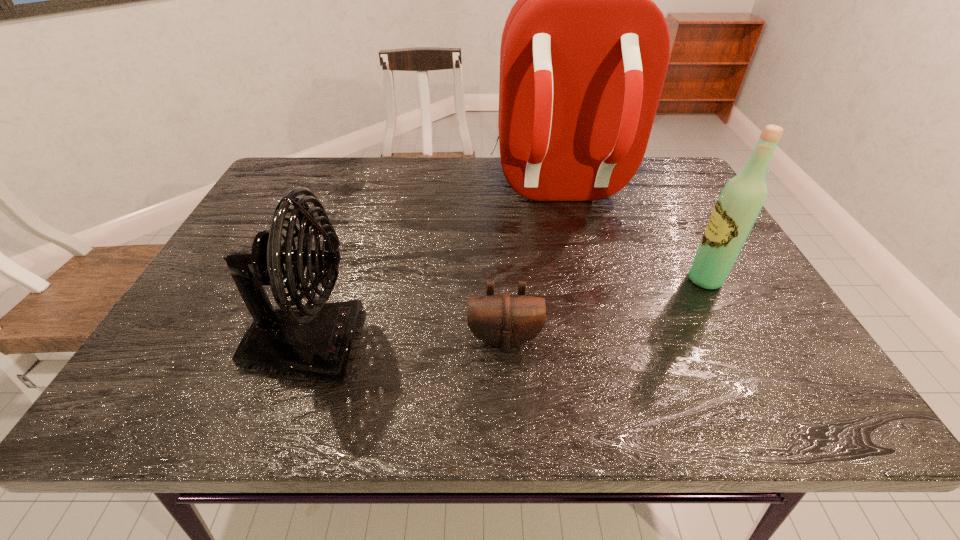
At what (x,y) coordinates should I click in order to perform the action: click on backpack. Please return your answer as a coordinate pair (x, y). Looking at the image, I should click on (584, 54).

Find the location of a particular element. The height and width of the screenshot is (540, 960). the tallest object is located at coordinates (584, 54).

At what (x,y) coordinates should I click in order to perform the action: click on wine bottle. Please return your answer as a coordinate pair (x, y). Image resolution: width=960 pixels, height=540 pixels. Looking at the image, I should click on (742, 198).

Where is `the rightmost object`? The height and width of the screenshot is (540, 960). the rightmost object is located at coordinates (742, 198).

Find the location of `fan`. fan is located at coordinates (315, 341).

Find the location of a particular element. The image size is (960, 540). pouch is located at coordinates (505, 320).

Find the location of a particular element. vacant space situated on the strap side of the backpack is located at coordinates (597, 346).

At what (x,y) coordinates should I click in order to perform the action: click on vacant space situated on the front-facing side of the rightmost object. Please return your answer as a coordinate pair (x, y). Looking at the image, I should click on (623, 279).

At what (x,y) coordinates should I click in order to perform the action: click on blank space located 0.350m on the front-facing side of the rightmost object. Please return your answer as a coordinate pair (x, y). Looking at the image, I should click on (538, 279).

Where is `free space located 0.060m on the front-facing side of the rightmost object`? The image size is (960, 540). free space located 0.060m on the front-facing side of the rightmost object is located at coordinates pos(661,279).